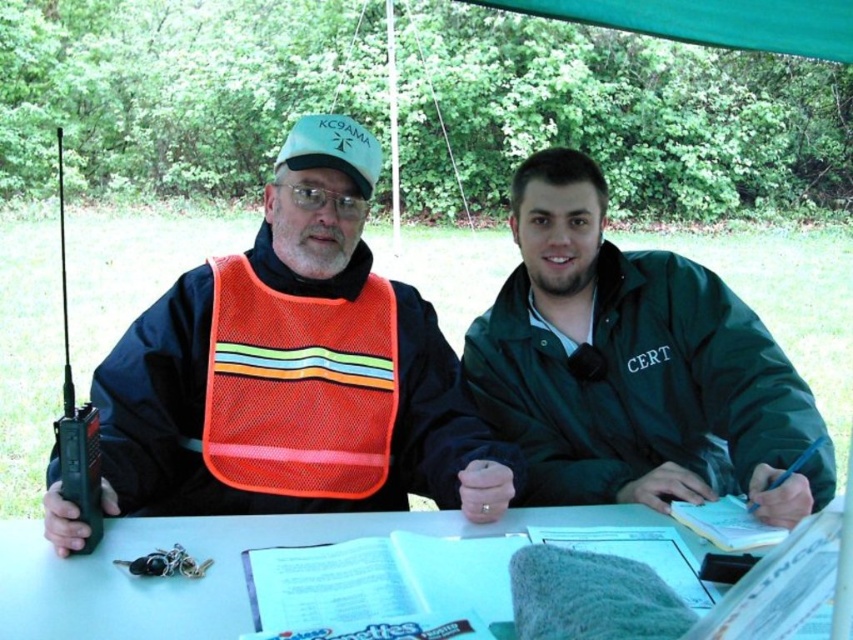
Is green matte jacket at center closer to camera compared to white paper at center?

That is False.

Does point (756, 497) come closer to viewer compared to point (450, 529)?

Yes, it is in front of point (450, 529).

You are a GUI agent. You are given a task and a screenshot of the screen. Output one action in this format:
    pyautogui.click(x=<x>, y=<y>)
    Task: Click on the green matte jacket at center
    
    Given the screenshot: What is the action you would take?
    pyautogui.click(x=633, y=365)

At what (x,y) coordinates should I click in order to perform the action: click on green matte jacket at center. Please return your answer as a coordinate pair (x, y). Looking at the image, I should click on (633, 365).

Consider the image. Who is taller, orange mesh vest at left or white paper at center?

orange mesh vest at left is taller.

Between orange mesh vest at left and white paper at center, which one appears on the right side from the viewer's perspective?

white paper at center is more to the right.

Identify the location of orange mesh vest at left. This screenshot has height=640, width=853. (294, 369).

Does green matte jacket at center come behind orange mesh safety vest at center?

No, green matte jacket at center is in front of orange mesh safety vest at center.

Is point (677, 256) more distant than point (207, 371)?

Yes, point (677, 256) is behind point (207, 371).

Describe the element at coordinates (633, 365) in the screenshot. I see `green matte jacket at center` at that location.

Where is `green matte jacket at center`? The height and width of the screenshot is (640, 853). green matte jacket at center is located at coordinates (633, 365).